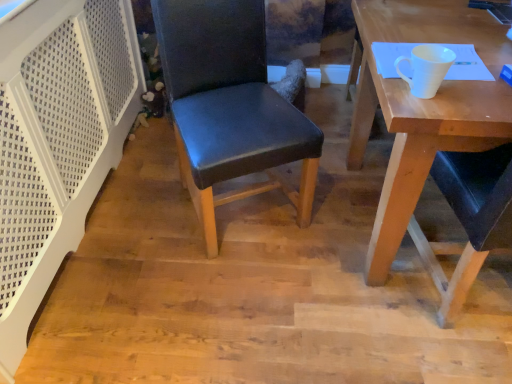
Where is `vacant space underneath black leather chair at center (from a real-world perspective)`? vacant space underneath black leather chair at center (from a real-world perspective) is located at coordinates (252, 218).